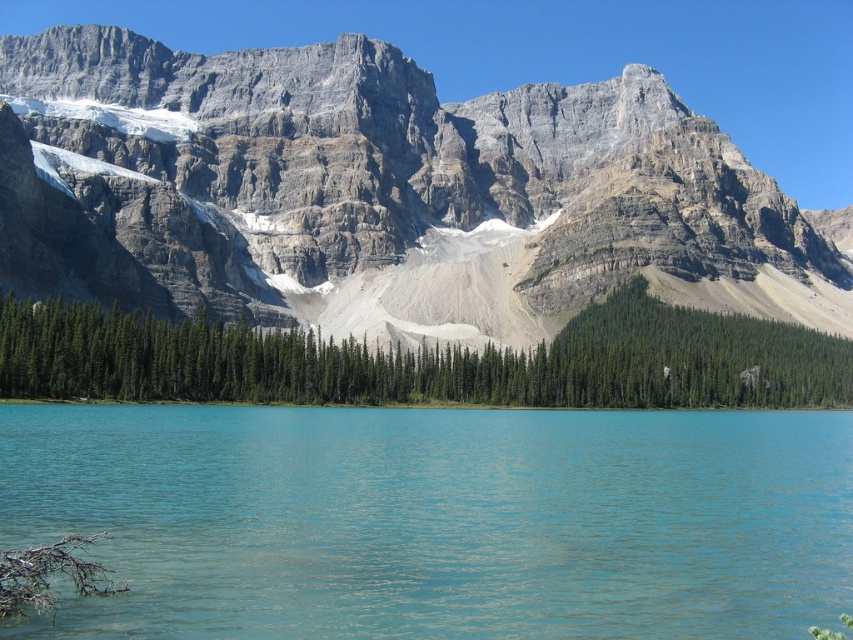
Question: Which of these objects is positioned farthest from the rocky gray mountain at upper center?

Choices:
 (A) turquoise water at center
 (B) green matte trees at center

Answer: (A)

Question: Does rocky gray mountain at upper center appear over green matte trees at center?

Choices:
 (A) no
 (B) yes

Answer: (B)

Question: Among these points, which one is farthest from the camera?

Choices:
 (A) (473, 605)
 (B) (328, 396)
 (C) (813, 260)

Answer: (C)

Question: Is rocky gray mountain at upper center above green matte trees at center?

Choices:
 (A) yes
 (B) no

Answer: (A)

Question: Can you confirm if turquoise water at center is positioned below green matte trees at center?

Choices:
 (A) yes
 (B) no

Answer: (A)

Question: Which point is farther to the camera?

Choices:
 (A) (364, 324)
 (B) (276, 611)

Answer: (A)